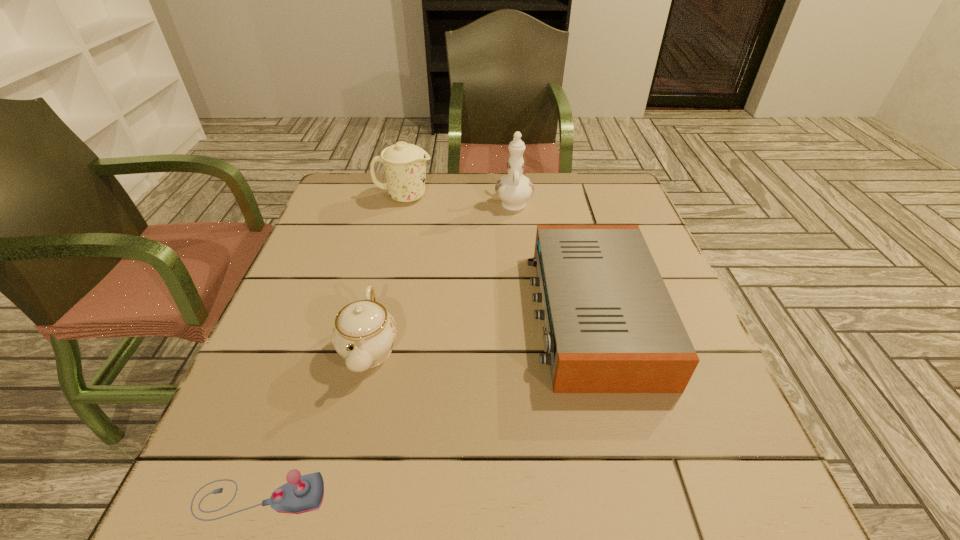
The height and width of the screenshot is (540, 960). I want to click on vacant space at the left edge of the desktop, so click(x=282, y=338).

Image resolution: width=960 pixels, height=540 pixels. In the image, there is a desktop. In order to click on vacant region at the far left corner in this screenshot , I will do `click(358, 206)`.

In the image, there is a desktop. Where is `vacant space at the near left corner`? The height and width of the screenshot is (540, 960). vacant space at the near left corner is located at coordinates (285, 467).

Find the location of a particular element. The image size is (960, 540). free region at the far right corner of the desktop is located at coordinates (614, 197).

You are a GUI agent. You are given a task and a screenshot of the screen. Output one action in this format:
    pyautogui.click(x=<x>, y=<y>)
    Task: Click on the free space between the nearest chinaware and the nearest object
    
    Given the screenshot: What is the action you would take?
    pyautogui.click(x=315, y=423)

Where is `vacant area that lies between the shortest chinaware and the second shortest chinaware`? The width and height of the screenshot is (960, 540). vacant area that lies between the shortest chinaware and the second shortest chinaware is located at coordinates (387, 273).

Find the location of a particular element. Image resolution: width=960 pixels, height=540 pixels. vacant area that lies between the third tallest object and the rightmost chinaware is located at coordinates (442, 275).

Where is `free space between the nearest chinaware and the fourth shortest object`? The image size is (960, 540). free space between the nearest chinaware and the fourth shortest object is located at coordinates (387, 273).

Where is `free space that is in between the radio receiver and the nearest object`? This screenshot has height=540, width=960. free space that is in between the radio receiver and the nearest object is located at coordinates (426, 406).

Where is `free spot between the third tallest object and the joystick`? free spot between the third tallest object and the joystick is located at coordinates (315, 423).